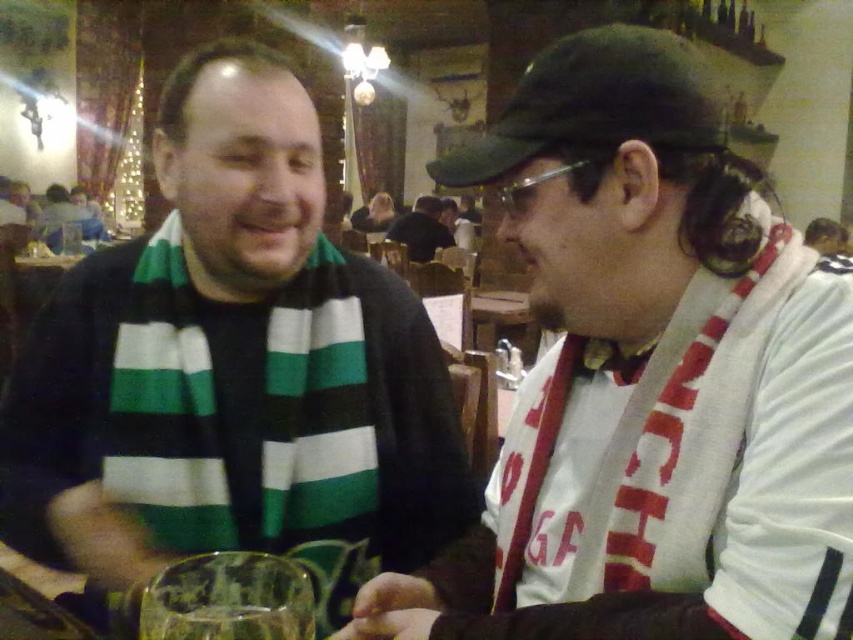
Between white fabric scarf at center and green striped scarf at upper left, which one is positioned lower?

Positioned lower is white fabric scarf at center.

Locate an element on the screen. white fabric scarf at center is located at coordinates (648, 378).

Does green and white striped scarf at left have a greater height compared to transparent glass at lower center?

Yes.

Between point (53, 323) and point (239, 566), which one is positioned behind?

The point (53, 323) is more distant.

Image resolution: width=853 pixels, height=640 pixels. In order to click on green and white striped scarf at left in this screenshot , I will do `click(233, 371)`.

You are a GUI agent. You are given a task and a screenshot of the screen. Output one action in this format:
    pyautogui.click(x=<x>, y=<y>)
    Task: Click on the green and white striped scarf at left
    
    Given the screenshot: What is the action you would take?
    pyautogui.click(x=233, y=371)

Does green matte baseball cap at upper center lie in front of white scarf at center?

Yes, it is.

Is green matte baseball cap at upper center wider than white scarf at center?

No.

Who is more forward, (688, 140) or (444, 224)?

Point (688, 140) is in front.

At what (x,y) coordinates should I click in order to perform the action: click on green matte baseball cap at upper center. Please return your answer as a coordinate pair (x, y). Image resolution: width=853 pixels, height=640 pixels. Looking at the image, I should click on 595,104.